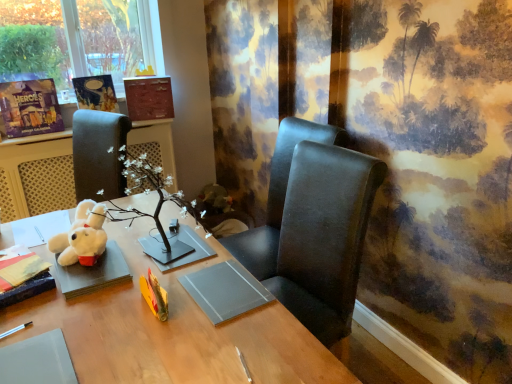
This screenshot has width=512, height=384. In order to click on free space above wooden desk at center (from a real-world perspective) in this screenshot , I will do `click(123, 296)`.